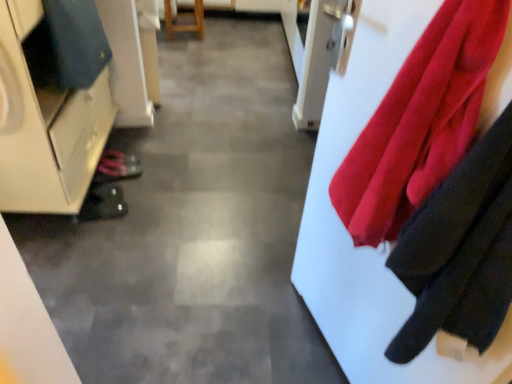
Find the location of a particular element. spots to the right of matte white cabinet at left is located at coordinates (182, 186).